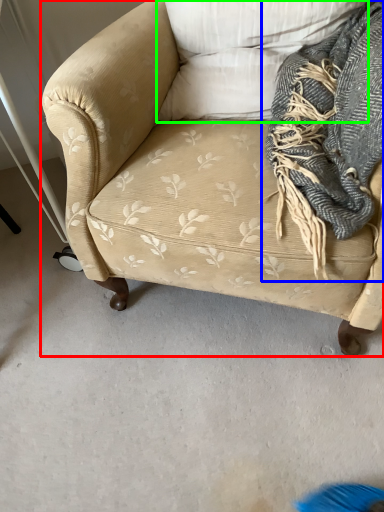
Question: Which object is the closest to the studio couch (highlighted by a red box)? Choose among these: scarf (highlighted by a blue box) or pillow (highlighted by a green box).

Choices:
 (A) scarf
 (B) pillow

Answer: (B)